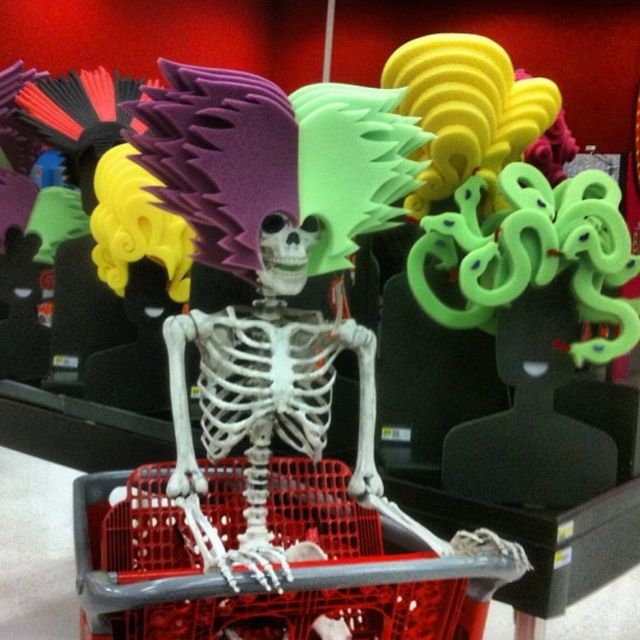
Does red plastic shopping basket at center come in front of green rubber snake at upper right?

Yes.

Who is positioned more to the right, red plastic shopping basket at center or green rubber snake at upper right?

From the viewer's perspective, green rubber snake at upper right appears more on the right side.

Between point (381, 532) and point (536, 432), which one is positioned in front?

Point (381, 532) is in front.

You are a GUI agent. You are given a task and a screenshot of the screen. Output one action in this format:
    pyautogui.click(x=<x>, y=<y>)
    Task: Click on the red plastic shopping basket at center
    This screenshot has width=640, height=640.
    Given the screenshot: What is the action you would take?
    pyautogui.click(x=253, y=579)